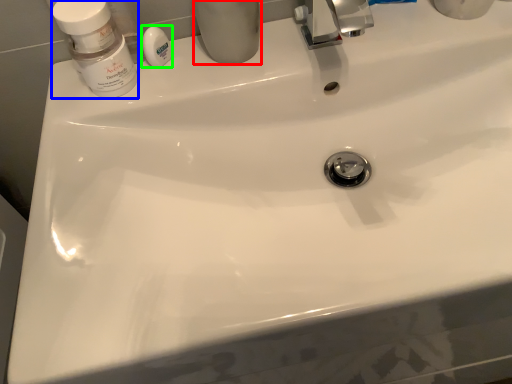
Question: Which is farther away from toiletry (highlighted by a red box)? mouthwash (highlighted by a blue box) or soap (highlighted by a green box)?

Choices:
 (A) mouthwash
 (B) soap

Answer: (A)